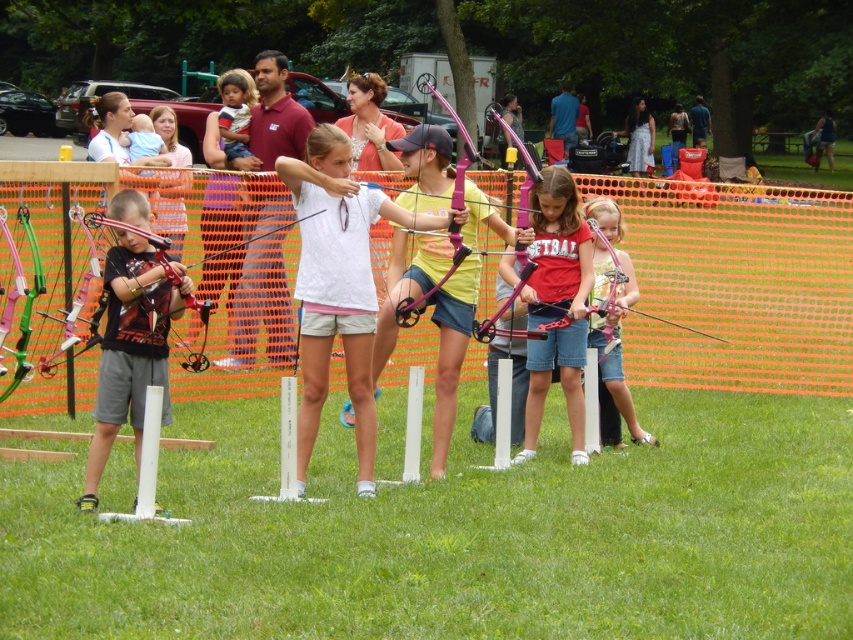
You are an archer standing at the center of the field. You notice the matte red bow at center and the matte pink bow at upper right. Which bow is closer to you?

Both the matte red bow at center and the matte pink bow at upper right are 31.59 meters apart from each other, so they are equidistant from your current position at the center.